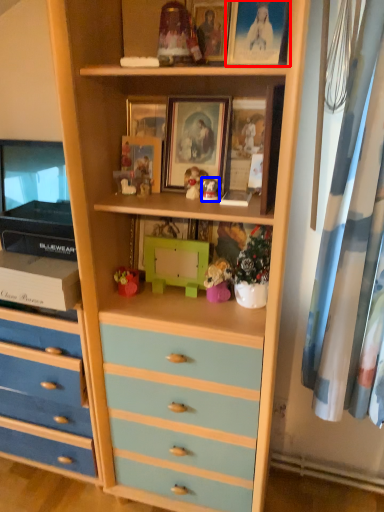
Question: Which of the following is the closest to the observer, picture frame (highlighted by a red box) or toy (highlighted by a blue box)?

Choices:
 (A) picture frame
 (B) toy

Answer: (A)